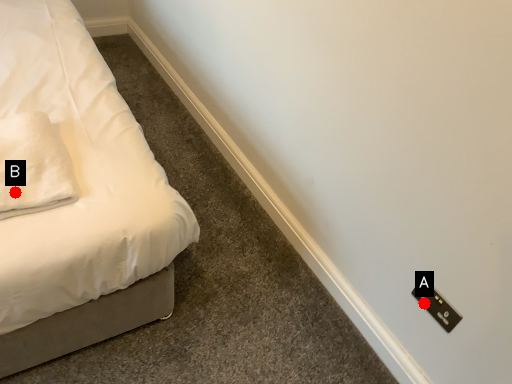
Question: Two points are circled on the image, labeled by A and B beside each circle. Which point is further to the camera?

Choices:
 (A) A is further
 (B) B is further

Answer: (A)